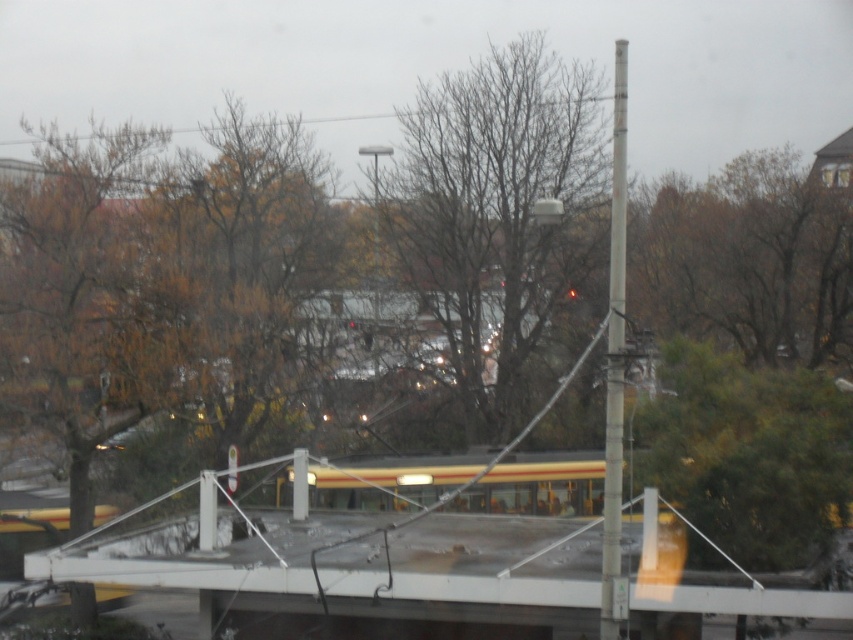
You are a pedestrian standing at the bus stop with the white railing. You want to cross the street to reach a friend waiting near the tram. The bare branches at center are in your path. Can you safely walk around them without getting too close?

The bare branches at center are 23.20 meters away from you, so you can safely walk around them as they are far enough to avoid any obstruction.

You are inside a bus and want to know how far the point at coordinates (x=476, y=529) is from your current position. Can you determine the distance?

The point at coordinates (x=476, y=529) is 88.97 feet away from the viewer.